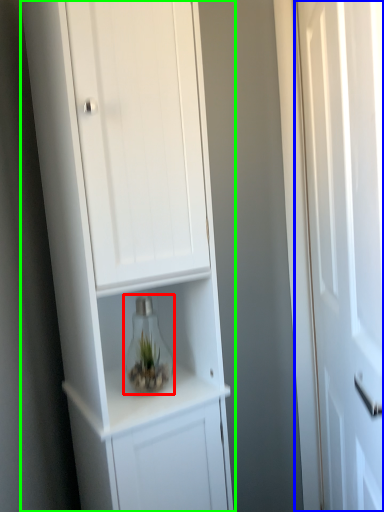
Question: Which is farther away from glass vase (highlighted by a red box)? door (highlighted by a blue box) or cupboard (highlighted by a green box)?

Choices:
 (A) door
 (B) cupboard

Answer: (A)